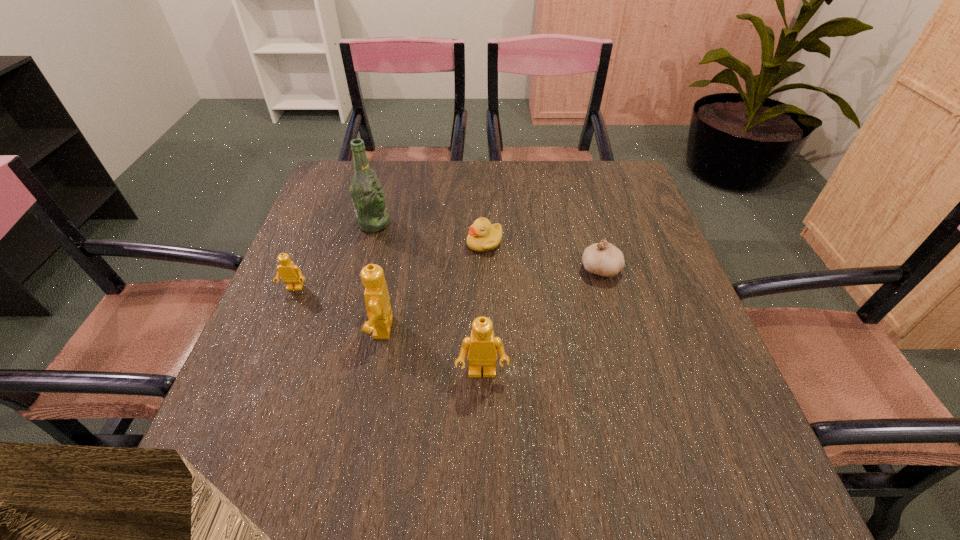
I want to click on Lego located in the left edge section of the desktop, so click(290, 273).

This screenshot has height=540, width=960. I want to click on beer bottle located in the left edge section of the desktop, so click(366, 190).

This screenshot has width=960, height=540. What are the coordinates of `object at the right edge` in the screenshot? It's located at (604, 259).

In order to click on vacant space at the far edge of the desktop in this screenshot , I will do `click(566, 161)`.

Find the location of a particular element. Image resolution: width=960 pixels, height=540 pixels. free spot at the near edge of the desktop is located at coordinates (532, 426).

Where is `free space at the left edge of the desktop`? This screenshot has width=960, height=540. free space at the left edge of the desktop is located at coordinates (307, 262).

Identify the location of blank area at the right edge. (648, 388).

This screenshot has height=540, width=960. Identify the location of free space at the far left corner. (337, 199).

Find the location of a particular element. vacant space at the near left corner is located at coordinates (300, 421).

In order to click on vacant area at the far right corner in this screenshot , I will do `click(622, 173)`.